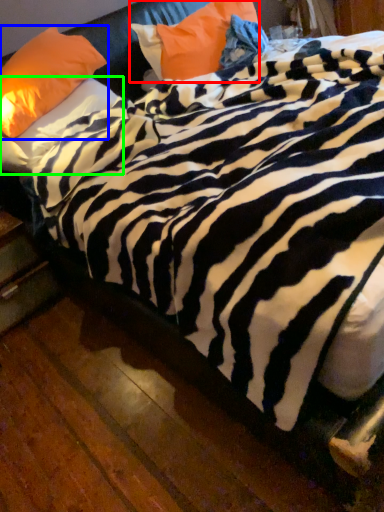
Question: Considering the real-world distances, which object is farthest from pillow (highlighted by a red box)? pillow (highlighted by a blue box) or pillow (highlighted by a green box)?

Choices:
 (A) pillow
 (B) pillow

Answer: (B)